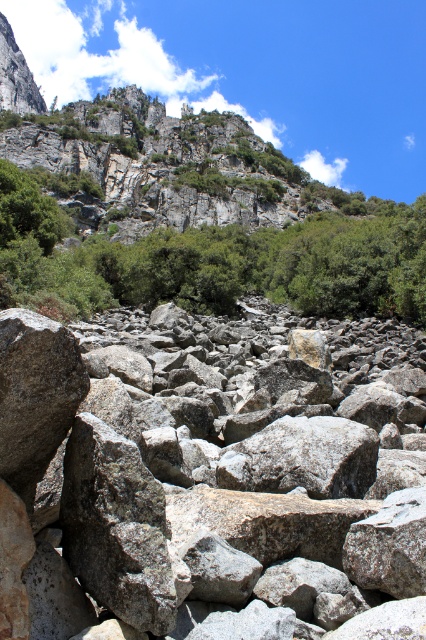
Question: Which point is closer to the camera?

Choices:
 (A) (23, 224)
 (B) (354, 365)

Answer: (B)

Question: Is gray rock at center further to the viewer compared to green leafy tree at upper center?

Choices:
 (A) no
 (B) yes

Answer: (A)

Question: Is gray rock at center in front of green leafy tree at upper center?

Choices:
 (A) yes
 (B) no

Answer: (A)

Question: Does gray rock at center appear on the right side of green leafy tree at upper center?

Choices:
 (A) yes
 (B) no

Answer: (B)